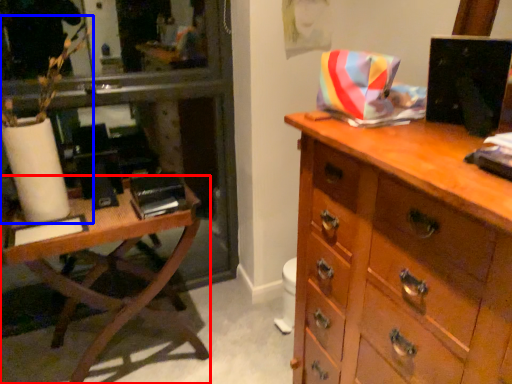
Question: Among these objects, which one is nearest to the camera, table (highlighted by a red box) or plant (highlighted by a blue box)?

Choices:
 (A) table
 (B) plant

Answer: (B)